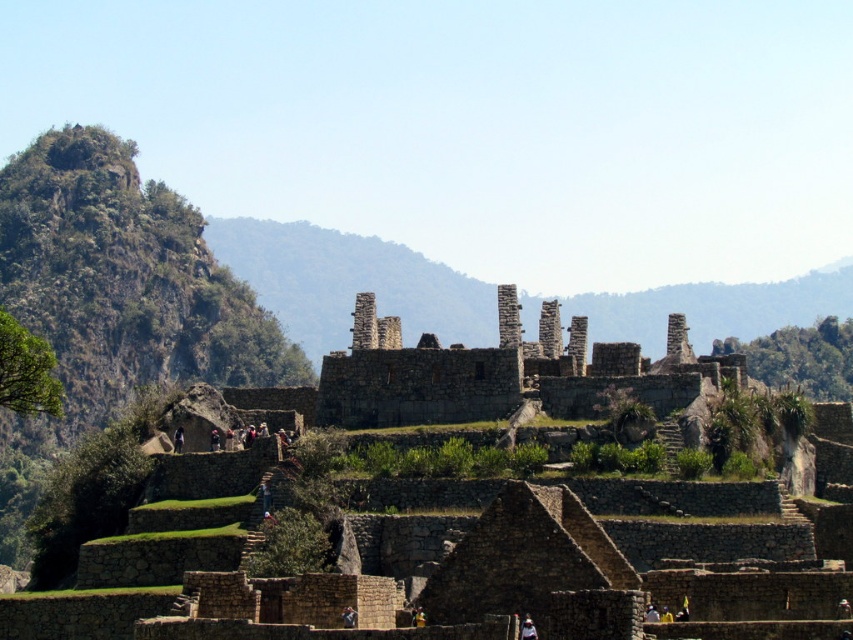
You are standing at the entrance of Machu Picchu and want to take a photo of the green rocky mountain at upper left. According to the coordinates provided, where exactly should you aim your camera?

The green rocky mountain at upper left is located at coordinates point (113, 301), so you should aim your camera there to capture it.

You are standing at the base of the green rocky mountain at upper left and want to reach the top. If your average climbing speed is 1.5 meters per minute, how many minutes will it take you to reach the top?

The green rocky mountain at upper left and viewer are 161.18 meters apart from each other. At a climbing speed of 1.5 meters per minute, it would take approximately 107.45 minutes to reach the top.

You are a photographer planning to capture a panoramic view of Machu Picchu. You want to include both the green rocky mountain at upper left and the stone ruins at center in your shot. Which object should you position on the left side of your frame to ensure both are included?

The green rocky mountain at upper left should be positioned on the left side of your frame because it is already on the left side of the stone ruins at center, ensuring both are included in the panoramic view.